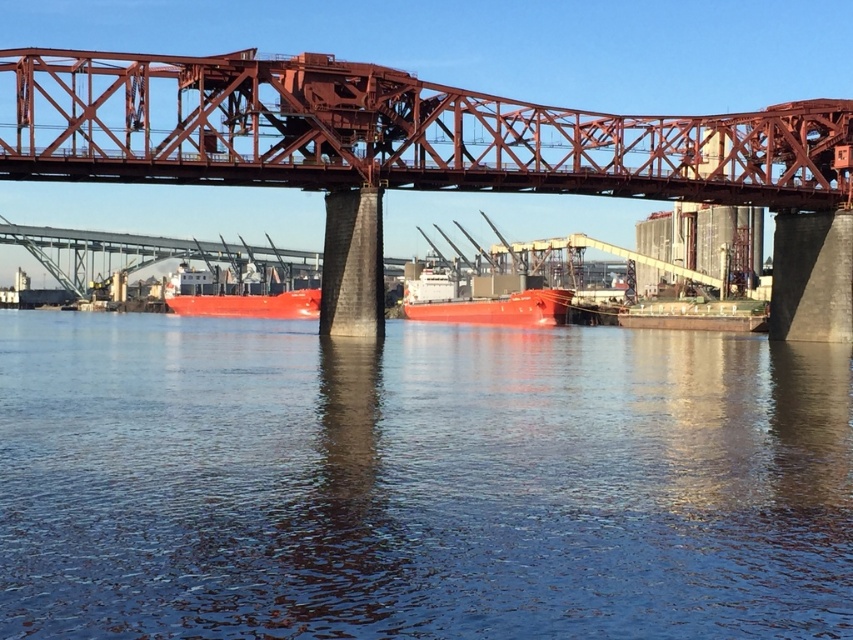
Can you confirm if glossy water at center is positioned below smooth red ship at center?

Indeed, glossy water at center is positioned under smooth red ship at center.

Based on the photo, can you confirm if glossy water at center is taller than smooth red ship at center?

No.

Between point (822, 476) and point (248, 266), which one is positioned in front?

Point (822, 476) is in front.

The image size is (853, 640). In order to click on glossy water at center in this screenshot , I will do `click(418, 481)`.

Is glossy water at center below smooth matte red ship at center?

Yes.

Who is more distant from viewer, (x=132, y=372) or (x=498, y=305)?

The point (x=498, y=305) is behind.

Which is behind, point (405, 484) or point (488, 278)?

Point (488, 278)

The height and width of the screenshot is (640, 853). I want to click on glossy water at center, so click(x=418, y=481).

Between glossy water at center and red steel bridge at center, which one appears on the left side from the viewer's perspective?

red steel bridge at center is more to the left.

Can you confirm if glossy water at center is positioned above red steel bridge at center?

No, glossy water at center is not above red steel bridge at center.

Which is behind, point (466, 611) or point (531, 112)?

Point (531, 112)

The image size is (853, 640). I want to click on glossy water at center, so click(x=418, y=481).